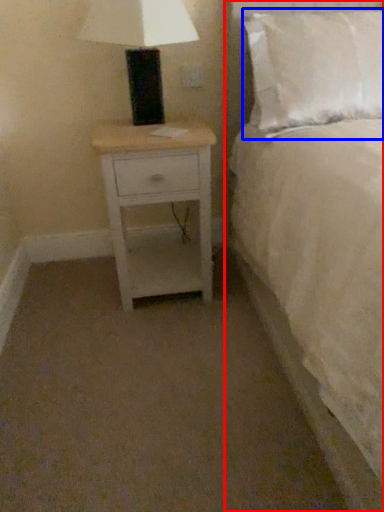
Question: Among these objects, which one is farthest to the camera, bed (highlighted by a red box) or pillow (highlighted by a blue box)?

Choices:
 (A) bed
 (B) pillow

Answer: (B)